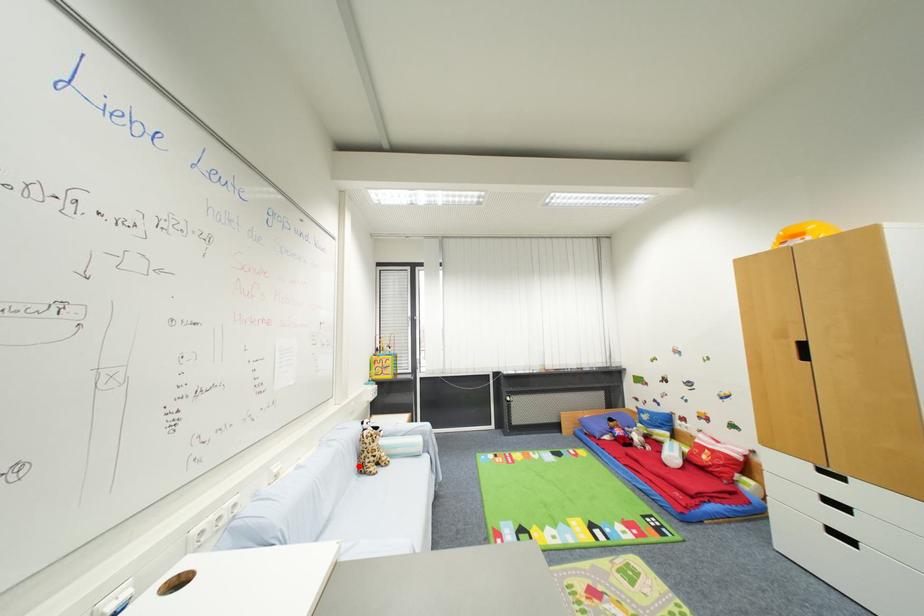
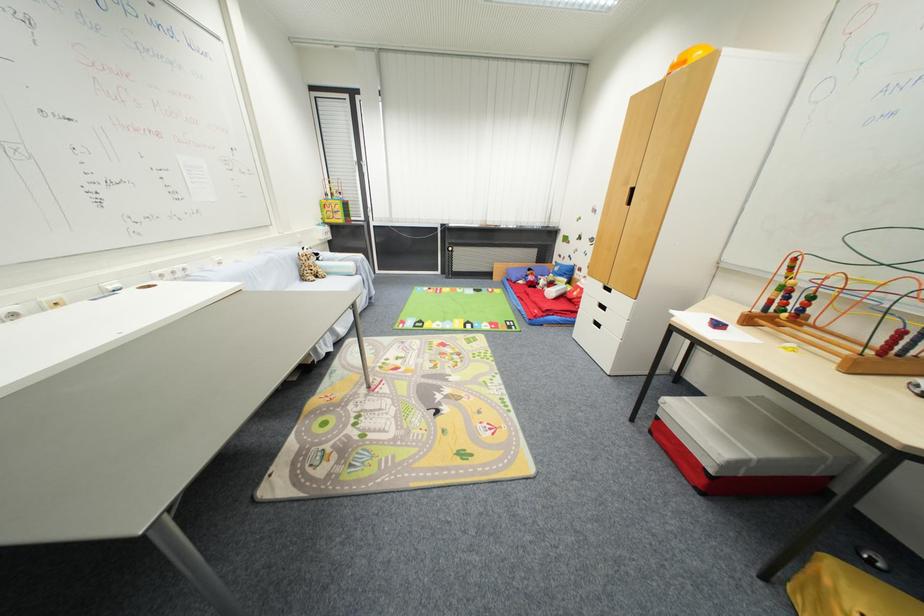
Question: I am providing you with two images of the same scene from different viewpoints. A red point is shown in image1. For the corresponding object point in image2, is it positioned nearer or farther from the camera?

Choices:
 (A) Nearer
 (B) Farther

Answer: (A)